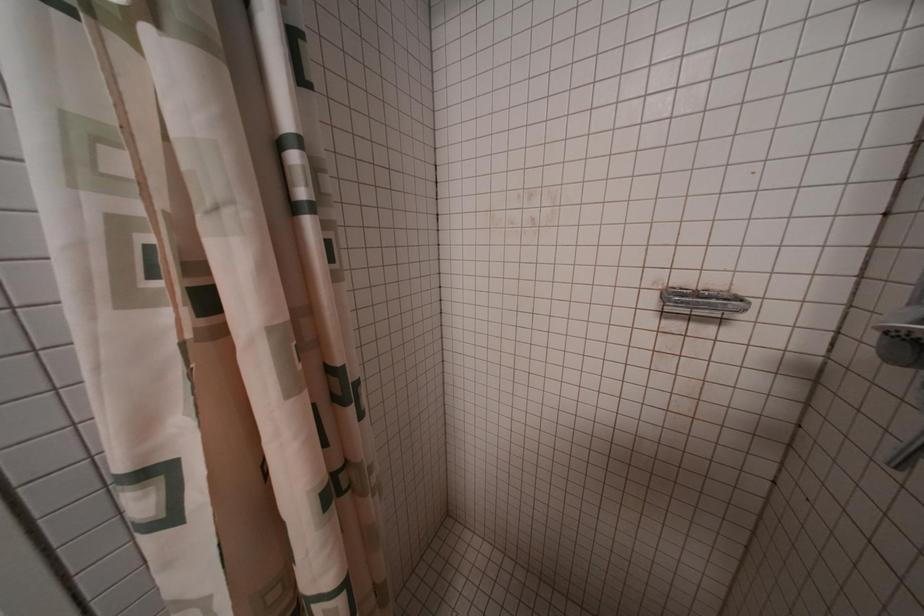
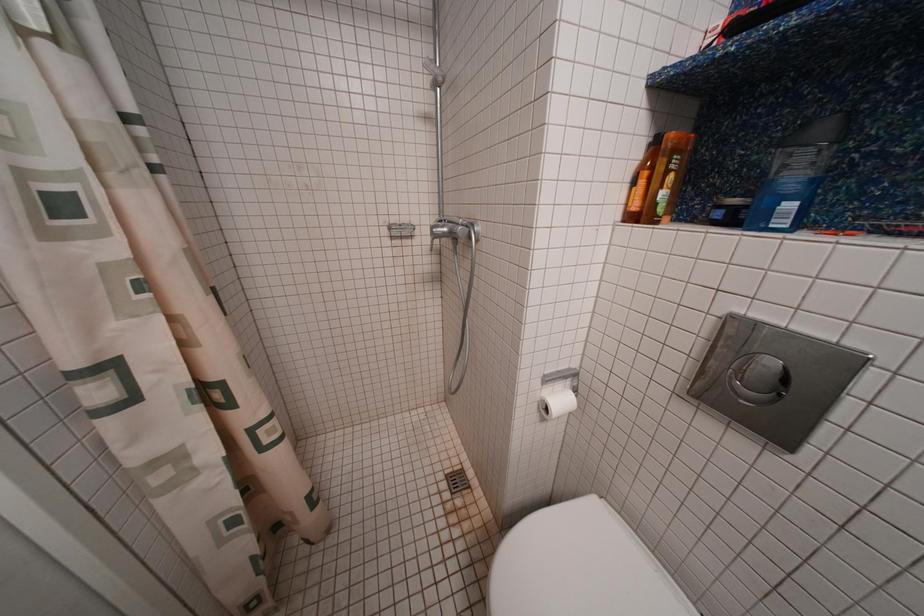
Question: The camera is either moving clockwise (left) or counter-clockwise (right) around the object. The first image is from the beginning of the video and the second image is from the end. Is the camera moving left or right when shooting the video?

Choices:
 (A) Left
 (B) Right

Answer: (A)